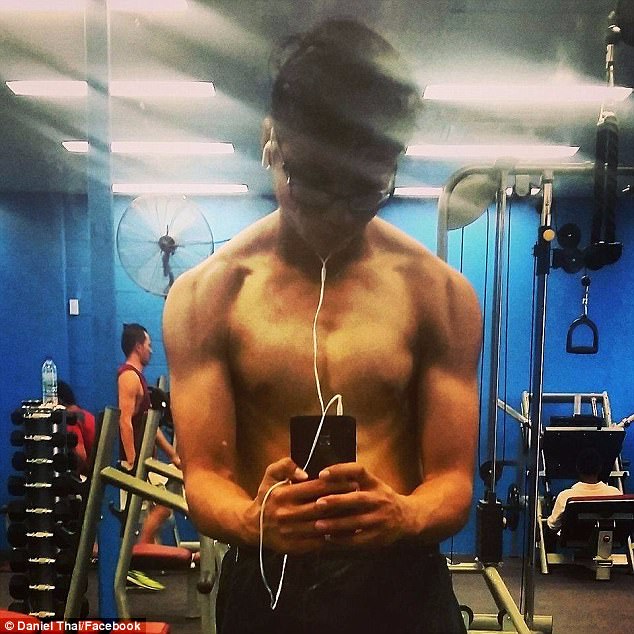
I want to click on blue wall, so click(555, 365).